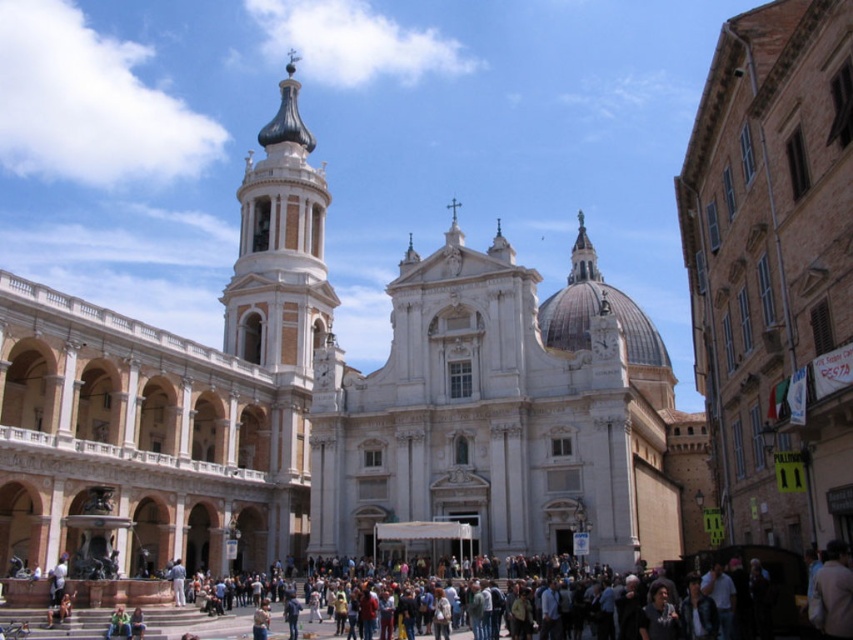
You are standing in the courtyard of the historic building complex. You see the white stone church at center and the white marble bell tower at upper left. Which one is located to the left of the other?

The white stone church at center is positioned on the right side of white marble bell tower at upper left, so the bell tower is to the left of the church.